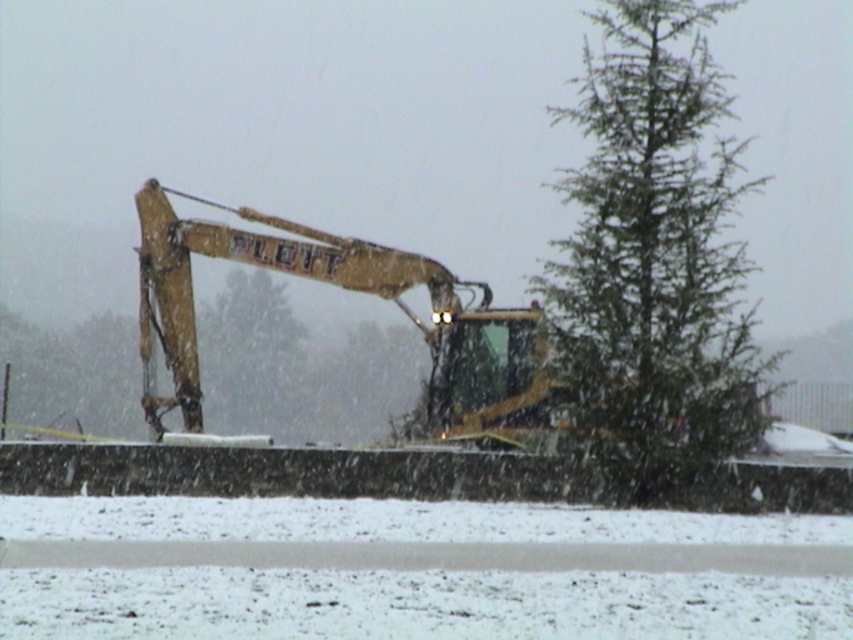
Is green needle-like tree at right thinner than yellow metallic excavator at center?

No, green needle-like tree at right is not thinner than yellow metallic excavator at center.

Image resolution: width=853 pixels, height=640 pixels. Describe the element at coordinates (654, 259) in the screenshot. I see `green needle-like tree at right` at that location.

Is point (717, 257) positioned in front of point (469, 404)?

Yes.

Identify the location of green needle-like tree at right. This screenshot has width=853, height=640. (654, 259).